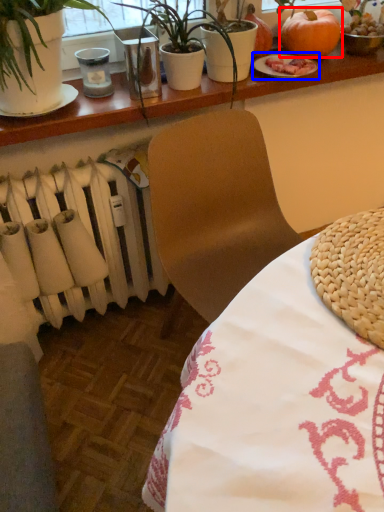
Question: Which of the following is the closest to the observer, pumpkin (highlighted by a red box) or tableware (highlighted by a blue box)?

Choices:
 (A) pumpkin
 (B) tableware

Answer: (B)